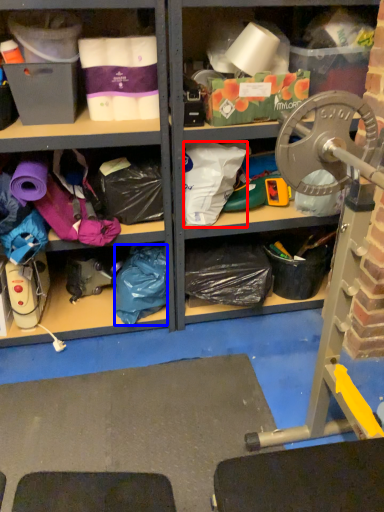
Question: Which object appears farthest to the camera in this image, clothing (highlighted by a red box) or clothing (highlighted by a blue box)?

Choices:
 (A) clothing
 (B) clothing

Answer: (B)